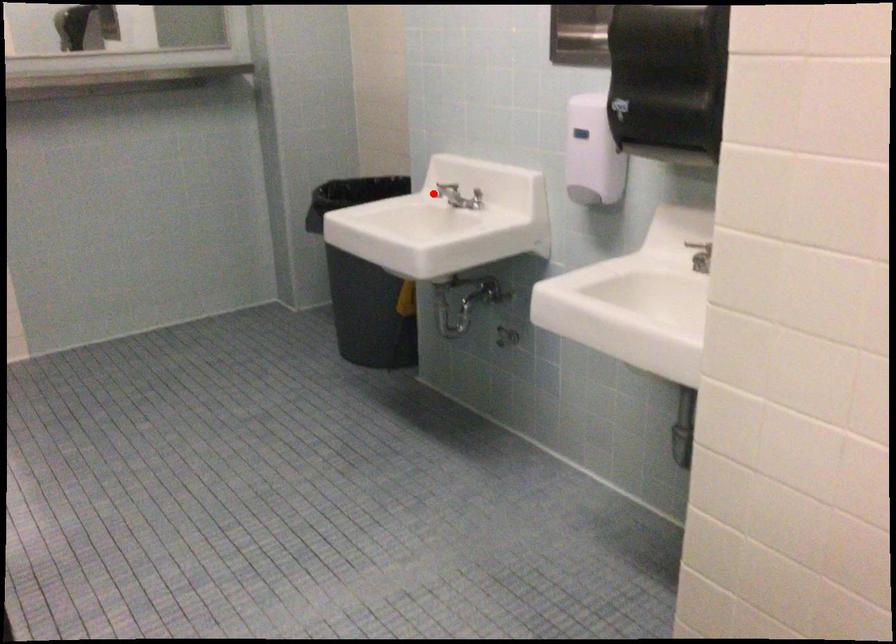
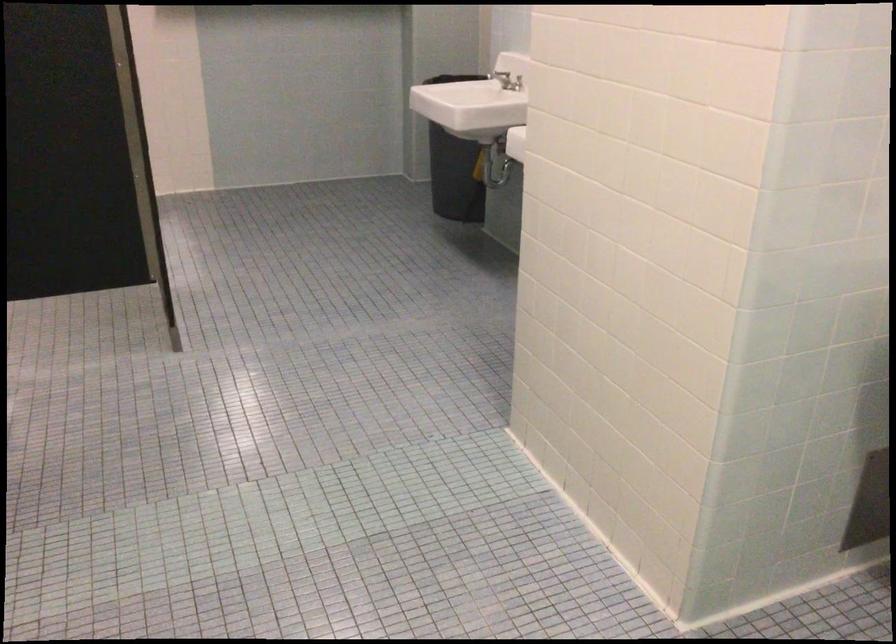
Question: A red point is marked in image1. In image2, is the corresponding 3D point closer to the camera or farther? Reply with the corresponding letter.

Choices:
 (A) The corresponding 3D point is closer.
 (B) The corresponding 3D point is farther.

Answer: (B)